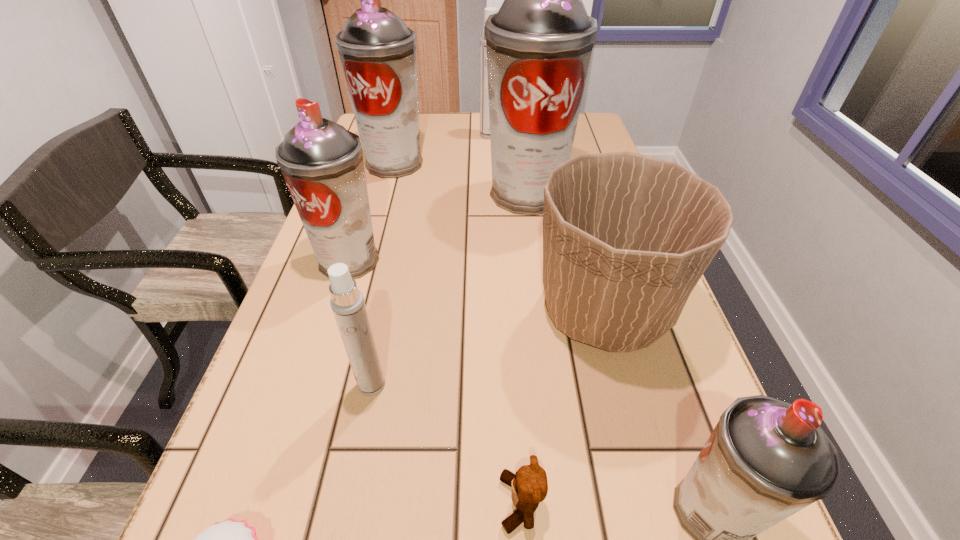
The image size is (960, 540). In order to click on free area in between the brown teddy bear and the third biggest gray aerosol can in this screenshot , I will do (x=435, y=382).

Locate which object ranks second in proximity to the cupcake. Please provide its 2D coordinates. Your answer should be formatted as a tuple, i.e. [(x, y)], where the tuple contains the x and y coordinates of a point satisfying the conditions above.

[(529, 485)]

Where is `object that is the third closest to the eighth shortest object`? This screenshot has height=540, width=960. object that is the third closest to the eighth shortest object is located at coordinates (322, 163).

Identify which aerosol can is located as the fourth nearest to the farther white aerosol can. Please provide its 2D coordinates. Your answer should be formatted as a tuple, i.e. [(x, y)], where the tuple contains the x and y coordinates of a point satisfying the conditions above.

[(347, 303)]

Identify which aerosol can is the second nearest to the second tallest object. Please provide its 2D coordinates. Your answer should be formatted as a tuple, i.e. [(x, y)], where the tuple contains the x and y coordinates of a point satisfying the conditions above.

[(539, 44)]

At what (x,y) coordinates should I click in order to perform the action: click on the third closest gray aerosol can relative to the brown teddy bear. Please return your answer as a coordinate pair (x, y). The image size is (960, 540). Looking at the image, I should click on (539, 44).

Image resolution: width=960 pixels, height=540 pixels. I want to click on gray aerosol can that is the third closest to the rightmost gray aerosol can, so click(x=377, y=51).

Image resolution: width=960 pixels, height=540 pixels. I want to click on free space that satisfies the following two spatial constraints: 1. on the back side of the third farthest gray aerosol can; 2. on the left side of the fifth shortest aerosol can, so click(x=380, y=163).

Find the location of a particular element. free spot that satisfies the following two spatial constraints: 1. on the back side of the smaller white aerosol can; 2. on the left side of the second gray aerosol can from right to left is located at coordinates (411, 193).

The height and width of the screenshot is (540, 960). In order to click on vacant space that satisfies the following two spatial constraints: 1. on the front side of the fifth shortest aerosol can; 2. on the right side of the flowerpot in this screenshot , I will do (353, 312).